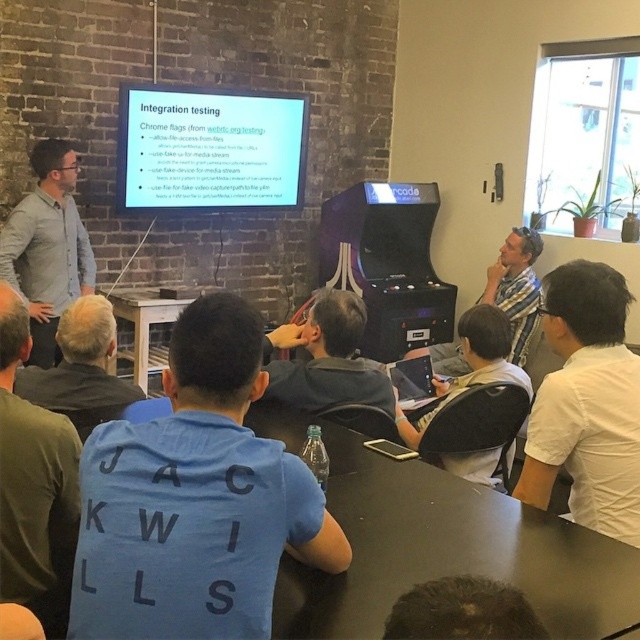
The image size is (640, 640). Describe the element at coordinates (438, 545) in the screenshot. I see `black matte table at lower center` at that location.

Is point (284, 406) positioned behind point (124, 321)?

No, (284, 406) is closer to viewer.

What do you see at coordinates (438, 545) in the screenshot? The height and width of the screenshot is (640, 640). I see `black matte table at lower center` at bounding box center [438, 545].

Identify the location of black matte table at lower center. (438, 545).

Is white glossy projector screen at upper center below matte black shirt at center?

Actually, white glossy projector screen at upper center is above matte black shirt at center.

Which is above, white glossy projector screen at upper center or matte black shirt at center?

white glossy projector screen at upper center is higher up.

Measure the distance between point (284, 96) and camera.

Point (284, 96) and camera are 4.42 meters apart.

I want to click on white glossy projector screen at upper center, so click(x=209, y=148).

Is gray shirt at left smaller than dark gray shirt at lower center?

Actually, gray shirt at left might be larger than dark gray shirt at lower center.

Is gray shirt at left further to camera compared to dark gray shirt at lower center?

Yes, gray shirt at left is behind dark gray shirt at lower center.

Where is `gray shirt at left`? The width and height of the screenshot is (640, 640). gray shirt at left is located at coordinates (48, 246).

Where is `gray shirt at left`? gray shirt at left is located at coordinates [48, 246].